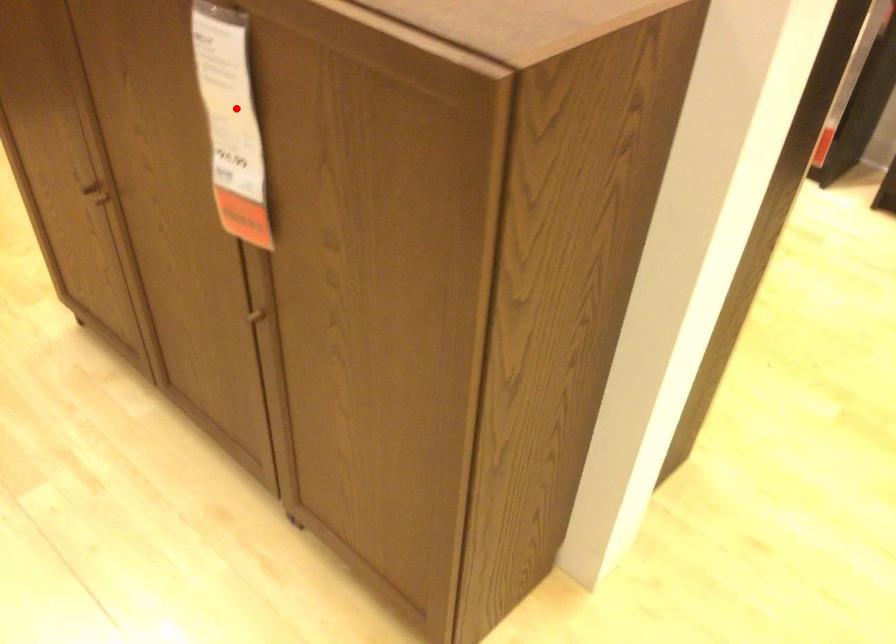
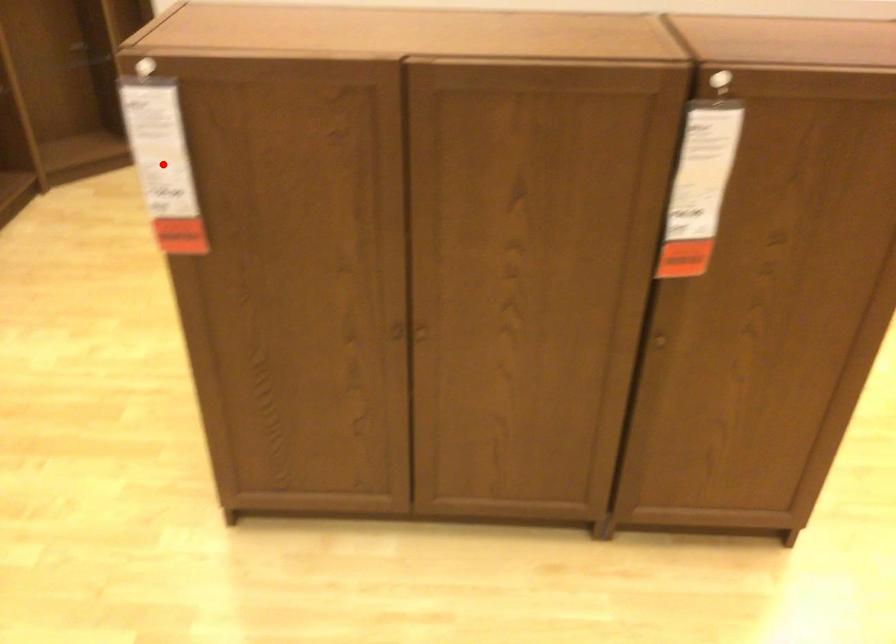
I am providing you with two images of the same scene from different viewpoints. A red point is marked on the first image and another point is marked on the second image. Do the highlighted points in image1 and image2 indicate the same real-world spot?

No